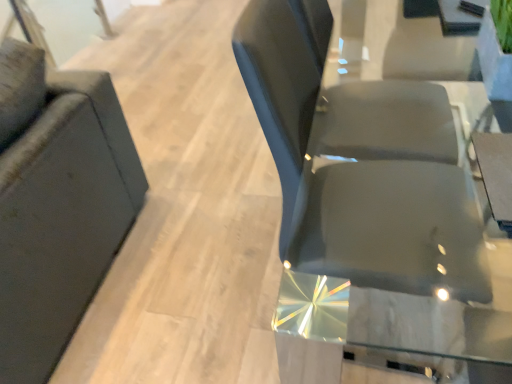
What do you see at coordinates (360, 163) in the screenshot? I see `glossy black chair at center, marked as the first chair in a right-to-left arrangement` at bounding box center [360, 163].

Measure the distance between matte black chair at left, which is counted as the first chair, starting from the left, and camera.

They are 3.83 feet apart.

Identify the location of glossy black chair at center, marked as the first chair in a right-to-left arrangement. Image resolution: width=512 pixels, height=384 pixels. (360, 163).

Can you confirm if transparent glass door at upper left is wider than glossy black chair at center, acting as the 2th chair starting from the left?

In fact, transparent glass door at upper left might be narrower than glossy black chair at center, acting as the 2th chair starting from the left.

Is transparent glass door at upper left in contact with glossy black chair at center, acting as the 2th chair starting from the left?

No, transparent glass door at upper left is not in contact with glossy black chair at center, acting as the 2th chair starting from the left.

Considering the relative sizes of transparent glass door at upper left and glossy black chair at center, marked as the first chair in a right-to-left arrangement, in the image provided, is transparent glass door at upper left shorter than glossy black chair at center, marked as the first chair in a right-to-left arrangement,?

Correct, transparent glass door at upper left is not as tall as glossy black chair at center, marked as the first chair in a right-to-left arrangement.

Where is `the 2nd chair counting from the right of the transparent glass door at upper left`? the 2nd chair counting from the right of the transparent glass door at upper left is located at coordinates (360, 163).

From a real-world perspective, is glossy black chair at center, acting as the 2th chair starting from the left, positioned above or below matte black chair at left, which is counted as the first chair, starting from the left?

A: Clearly, from a real-world perspective, glossy black chair at center, acting as the 2th chair starting from the left, is above matte black chair at left, which is counted as the first chair, starting from the left.

Is glossy black chair at center, marked as the first chair in a right-to-left arrangement, smaller than matte black chair at left, which is counted as the first chair, starting from the left?

Indeed, glossy black chair at center, marked as the first chair in a right-to-left arrangement, has a smaller size compared to matte black chair at left, which is counted as the first chair, starting from the left.

Does point (310, 225) appear closer or farther from the camera than point (40, 199)?

Point (310, 225).

Can you confirm if glossy black chair at center, marked as the first chair in a right-to-left arrangement, is thinner than matte black chair at left, which appears as the 2th chair when viewed from the right?

Correct, the width of glossy black chair at center, marked as the first chair in a right-to-left arrangement, is less than that of matte black chair at left, which appears as the 2th chair when viewed from the right.

The image size is (512, 384). What are the coordinates of `glass door that appears above the matte black chair at left, which is counted as the first chair, starting from the left (from the image's perspective)` in the screenshot? It's located at (60, 25).

Does matte black chair at left, which appears as the 2th chair when viewed from the right, lie behind transparent glass door at upper left?

No, matte black chair at left, which appears as the 2th chair when viewed from the right, is closer to the camera.

Considering the relative sizes of matte black chair at left, which appears as the 2th chair when viewed from the right, and transparent glass door at upper left in the image provided, is matte black chair at left, which appears as the 2th chair when viewed from the right, smaller than transparent glass door at upper left?

Actually, matte black chair at left, which appears as the 2th chair when viewed from the right, might be larger than transparent glass door at upper left.

Which of these two, matte black chair at left, which is counted as the first chair, starting from the left, or transparent glass door at upper left, stands shorter?

With less height is transparent glass door at upper left.

Which point is more forward, (39, 361) or (342, 254)?

The point (342, 254) is closer to the camera.

Is matte black chair at left, which appears as the 2th chair when viewed from the right, at the left side of glossy black chair at center, marked as the first chair in a right-to-left arrangement?

Yes.

Could glossy black chair at center, marked as the first chair in a right-to-left arrangement, be considered to be inside matte black chair at left, which appears as the 2th chair when viewed from the right?

Actually, glossy black chair at center, marked as the first chair in a right-to-left arrangement, is outside matte black chair at left, which appears as the 2th chair when viewed from the right.

Is glossy black chair at center, acting as the 2th chair starting from the left, taller or shorter than transparent glass door at upper left?

Considering their sizes, glossy black chair at center, acting as the 2th chair starting from the left, has more height than transparent glass door at upper left.

Considering the points (390, 229) and (41, 20), which point is behind, point (390, 229) or point (41, 20)?

The point (41, 20) is farther from the camera.

Can you tell me how much glossy black chair at center, marked as the first chair in a right-to-left arrangement, and transparent glass door at upper left differ in facing direction?

glossy black chair at center, marked as the first chair in a right-to-left arrangement, and transparent glass door at upper left are facing 2.82 degrees away from each other.

Which of these two, glossy black chair at center, marked as the first chair in a right-to-left arrangement, or transparent glass door at upper left, is bigger?

glossy black chair at center, marked as the first chair in a right-to-left arrangement.

Which is more to the left, transparent glass door at upper left or matte black chair at left, which appears as the 2th chair when viewed from the right?

Positioned to the left is transparent glass door at upper left.

Looking at this image, which object is closer to the camera taking this photo, transparent glass door at upper left or matte black chair at left, which appears as the 2th chair when viewed from the right?

matte black chair at left, which appears as the 2th chair when viewed from the right, is more forward.

Is matte black chair at left, which is counted as the first chair, starting from the left, located within transparent glass door at upper left?

Actually, matte black chair at left, which is counted as the first chair, starting from the left, is outside transparent glass door at upper left.

The height and width of the screenshot is (384, 512). I want to click on glass door on the left of glossy black chair at center, marked as the first chair in a right-to-left arrangement, so click(60, 25).

I want to click on chair beneath the glossy black chair at center, acting as the 2th chair starting from the left (from a real-world perspective), so click(x=57, y=203).

When comparing their distances from glossy black chair at center, marked as the first chair in a right-to-left arrangement, does matte black chair at left, which appears as the 2th chair when viewed from the right, or transparent glass door at upper left seem closer?

The object closer to glossy black chair at center, marked as the first chair in a right-to-left arrangement, is matte black chair at left, which appears as the 2th chair when viewed from the right.

When comparing their distances from glossy black chair at center, acting as the 2th chair starting from the left, does transparent glass door at upper left or matte black chair at left, which is counted as the first chair, starting from the left, seem closer?

Based on the image, matte black chair at left, which is counted as the first chair, starting from the left, appears to be nearer to glossy black chair at center, acting as the 2th chair starting from the left.

When comparing their distances from transparent glass door at upper left, does glossy black chair at center, acting as the 2th chair starting from the left, or matte black chair at left, which appears as the 2th chair when viewed from the right, seem closer?

matte black chair at left, which appears as the 2th chair when viewed from the right.

Estimate the real-world distances between objects in this image. Which object is further from transparent glass door at upper left, matte black chair at left, which appears as the 2th chair when viewed from the right, or glossy black chair at center, marked as the first chair in a right-to-left arrangement?

glossy black chair at center, marked as the first chair in a right-to-left arrangement, is positioned further to the anchor transparent glass door at upper left.

Based on their spatial positions, is transparent glass door at upper left or glossy black chair at center, acting as the 2th chair starting from the left, closer to matte black chair at left, which appears as the 2th chair when viewed from the right?

Based on the image, glossy black chair at center, acting as the 2th chair starting from the left, appears to be nearer to matte black chair at left, which appears as the 2th chair when viewed from the right.

Which object lies nearer to the anchor point matte black chair at left, which appears as the 2th chair when viewed from the right, glossy black chair at center, acting as the 2th chair starting from the left, or transparent glass door at upper left?

glossy black chair at center, acting as the 2th chair starting from the left, is closer to matte black chair at left, which appears as the 2th chair when viewed from the right.

Where is `chair positioned between glossy black chair at center, acting as the 2th chair starting from the left, and transparent glass door at upper left from near to far`? chair positioned between glossy black chair at center, acting as the 2th chair starting from the left, and transparent glass door at upper left from near to far is located at coordinates (57, 203).